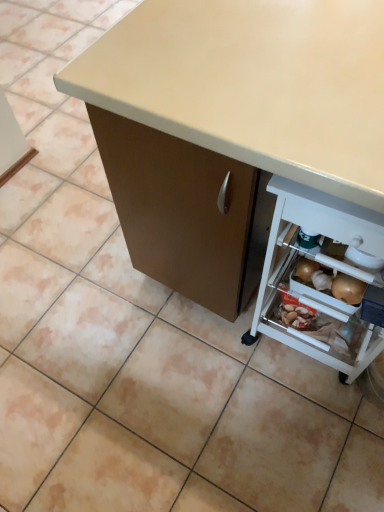
You are a GUI agent. You are given a task and a screenshot of the screen. Output one action in this format:
    pyautogui.click(x=<x>, y=<y>)
    Task: Click on the vacant space situated on the left part of matte beige desk at center
    The height and width of the screenshot is (512, 384).
    Given the screenshot: What is the action you would take?
    pyautogui.click(x=82, y=309)